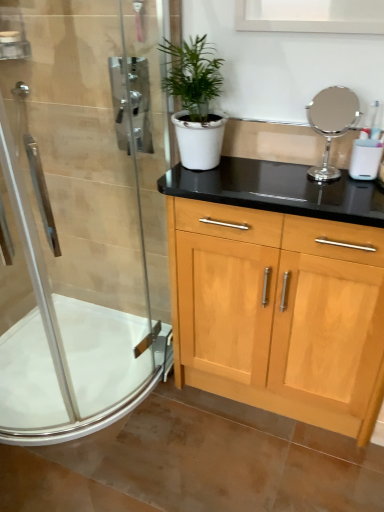
Measure the distance between point (61, 429) and camera.

Point (61, 429) and camera are 1.75 meters apart.

Locate an element on the screen. polished chrome mirror at upper right is located at coordinates (331, 124).

Locate an element on the screen. mirror located in front of the white glossy bath at lower left is located at coordinates (331, 124).

Consider the image. Is polished chrome mirror at upper right with white glossy bath at lower left?

No.

Can you confirm if polished chrome mirror at upper right is taller than white glossy bath at lower left?

Correct, polished chrome mirror at upper right is much taller as white glossy bath at lower left.

Is the position of white glossy bath at lower left more distant than that of polished chrome mirror at upper right?

Yes, it is behind polished chrome mirror at upper right.

Which of these two, white glossy bath at lower left or polished chrome mirror at upper right, is bigger?

white glossy bath at lower left is bigger.

From a real-world perspective, is white glossy bath at lower left on top of polished chrome mirror at upper right?

Incorrect, from a real-world perspective, white glossy bath at lower left is lower than polished chrome mirror at upper right.

From the image's perspective, is white glossy bath at lower left located beneath polished chrome mirror at upper right?

Indeed, from the image's perspective, white glossy bath at lower left is shown beneath polished chrome mirror at upper right.

Find the location of a particular element. This screenshot has height=512, width=384. mirror above the clear glass shower door at left (from the image's perspective) is located at coordinates (331, 124).

Is point (340, 88) behind point (40, 168)?

No, (340, 88) is closer to viewer.

Looking at this image, which is more to the left, polished chrome mirror at upper right or clear glass shower door at left?

From the viewer's perspective, clear glass shower door at left appears more on the left side.

Considering the sizes of polished chrome mirror at upper right and clear glass shower door at left in the image, is polished chrome mirror at upper right taller or shorter than clear glass shower door at left?

Considering their sizes, polished chrome mirror at upper right has less height than clear glass shower door at left.

Is white matte pot at center wider or thinner than polished chrome mirror at upper right?

white matte pot at center is wider than polished chrome mirror at upper right.

From the image's perspective, between white matte pot at center and polished chrome mirror at upper right, which one is located above?

white matte pot at center.

From the picture: Considering the sizes of objects white matte pot at center and polished chrome mirror at upper right in the image provided, who is smaller, white matte pot at center or polished chrome mirror at upper right?

polished chrome mirror at upper right is smaller.

Which object is positioned more to the left, white matte pot at center or polished chrome mirror at upper right?

Positioned to the left is white matte pot at center.

From a real-world perspective, which is physically above, polished chrome mirror at upper right or white matte pot at center?

white matte pot at center.

The width and height of the screenshot is (384, 512). In order to click on houseplant in front of the polished chrome mirror at upper right in this screenshot , I will do `click(196, 102)`.

Is polished chrome mirror at upper right bigger than white matte pot at center?

Actually, polished chrome mirror at upper right might be smaller than white matte pot at center.

Where is `mirror that is behind the clear glass shower door at left`? mirror that is behind the clear glass shower door at left is located at coordinates (331, 124).

From the image's perspective, is clear glass shower door at left beneath polished chrome mirror at upper right?

Correct, clear glass shower door at left appears lower than polished chrome mirror at upper right in the image.

Consider the image. Is clear glass shower door at left thinner than polished chrome mirror at upper right?

A: Incorrect, the width of clear glass shower door at left is not less than that of polished chrome mirror at upper right.

Is clear glass shower door at left wider or thinner than white matte pot at center?

In the image, clear glass shower door at left appears to be more narrow than white matte pot at center.

Is the position of clear glass shower door at left less distant than that of white matte pot at center?

Yes, clear glass shower door at left is closer to the camera.

From the image's perspective, between clear glass shower door at left and white matte pot at center, who is located below?

clear glass shower door at left appears lower in the image.

Considering the relative sizes of clear glass shower door at left and white matte pot at center in the image provided, is clear glass shower door at left smaller than white matte pot at center?

No, clear glass shower door at left is not smaller than white matte pot at center.

You are a GUI agent. You are given a task and a screenshot of the screen. Output one action in this format:
    pyautogui.click(x=<x>, y=<y>)
    Task: Click on the mirror in front of the white glossy bath at lower left
    Image resolution: width=384 pixels, height=512 pixels.
    Given the screenshot: What is the action you would take?
    pyautogui.click(x=331, y=124)

Locate an element on the screen. The width and height of the screenshot is (384, 512). mirror located above the white glossy bath at lower left (from a real-world perspective) is located at coordinates (331, 124).

Based on their spatial positions, is polished chrome mirror at upper right or clear glass shower door at left closer to white matte pot at center?

polished chrome mirror at upper right lies closer to white matte pot at center than the other object.

When comparing their distances from white matte pot at center, does white glossy bath at lower left or polished chrome mirror at upper right seem further?

white glossy bath at lower left is further to white matte pot at center.

Looking at the image, which one is located further to clear glass shower door at left, white glossy bath at lower left or white matte pot at center?

white matte pot at center lies further to clear glass shower door at left than the other object.

Looking at the image, which one is located further to clear glass shower door at left, white matte pot at center or white glossy bath at lower left?

Among the two, white matte pot at center is located further to clear glass shower door at left.

Estimate the real-world distances between objects in this image. Which object is closer to white glossy bath at lower left, clear glass shower door at left or white matte pot at center?

Among the two, clear glass shower door at left is located nearer to white glossy bath at lower left.

Which object lies further to the anchor point clear glass shower door at left, polished chrome mirror at upper right or white glossy bath at lower left?

Based on the image, polished chrome mirror at upper right appears to be further to clear glass shower door at left.

When comparing their distances from polished chrome mirror at upper right, does white glossy bath at lower left or white matte pot at center seem closer?

white matte pot at center.

Considering their positions, is white matte pot at center positioned further to clear glass shower door at left than polished chrome mirror at upper right?

The object further to clear glass shower door at left is polished chrome mirror at upper right.

What are the coordinates of `mirror between white matte pot at center and white glossy bath at lower left in the up-down direction` in the screenshot? It's located at (331, 124).

Find the location of `shower door situated between white glossy bath at lower left and polished chrome mirror at upper right from left to right`. shower door situated between white glossy bath at lower left and polished chrome mirror at upper right from left to right is located at coordinates (79, 215).

I want to click on shower door between white matte pot at center and white glossy bath at lower left vertically, so click(x=79, y=215).

Find the location of a particular element. houseplant between clear glass shower door at left and polished chrome mirror at upper right from left to right is located at coordinates (196, 102).